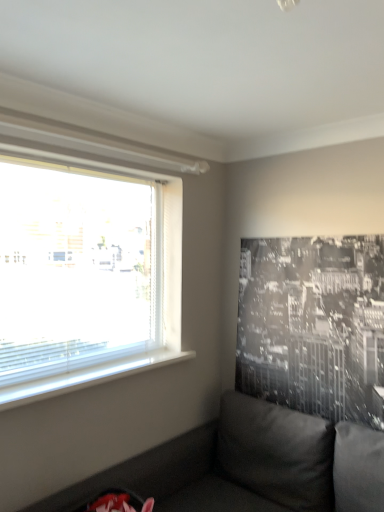
The width and height of the screenshot is (384, 512). What do you see at coordinates (251, 465) in the screenshot?
I see `dark gray fabric couch at lower right` at bounding box center [251, 465].

Image resolution: width=384 pixels, height=512 pixels. In order to click on dark gray fabric couch at lower right in this screenshot , I will do `click(251, 465)`.

In order to face dark gray fabric couch at lower right, should I rotate leftwards or rightwards?

To face it directly, rotate left by 0.828 degrees.

What are the coordinates of `dark gray fabric couch at lower right` in the screenshot? It's located at (251, 465).